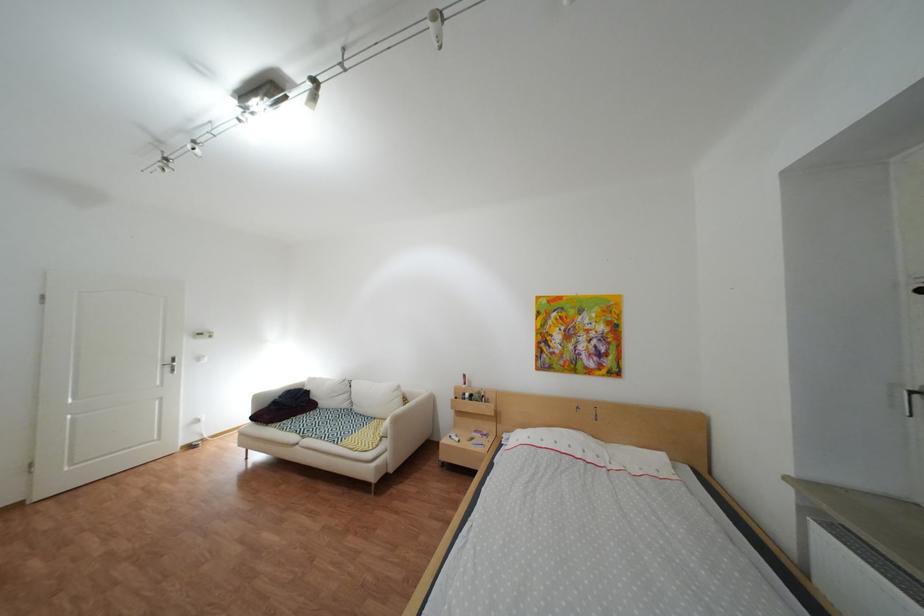
Find where to sit the sofa sitting surface. Please return your answer as a coordinate pair (x, y).

(335, 428)